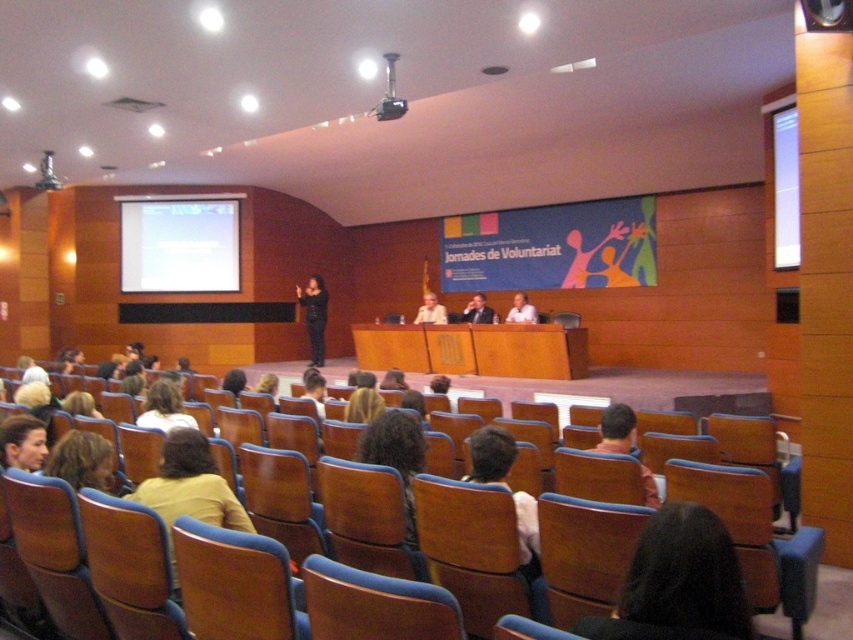
In the auditorium scene, you see an orange fabric shirt at center and a black plastic projector at upper center. Which object takes up more visual space in the image?

The orange fabric shirt at center is bigger than the black plastic projector at upper center, so it takes up more visual space.

You are an event organizer who needs to ensure that the orange fabric shirt at center and the black plastic projector at upper center are visible to all attendees. Which object is wider and might require a better positioned spotlight?

The orange fabric shirt at center is wider than the black plastic projector at upper center, so it might require a better positioned spotlight to ensure visibility.

From the picture: You are an attendee in the auditorium and need to sit down. You see a brown wood chair at lower left and a light brown hair at center. Which object is narrower?

The brown wood chair at lower left has a lesser width compared to light brown hair at center, so the brown wood chair at lower left is narrower.